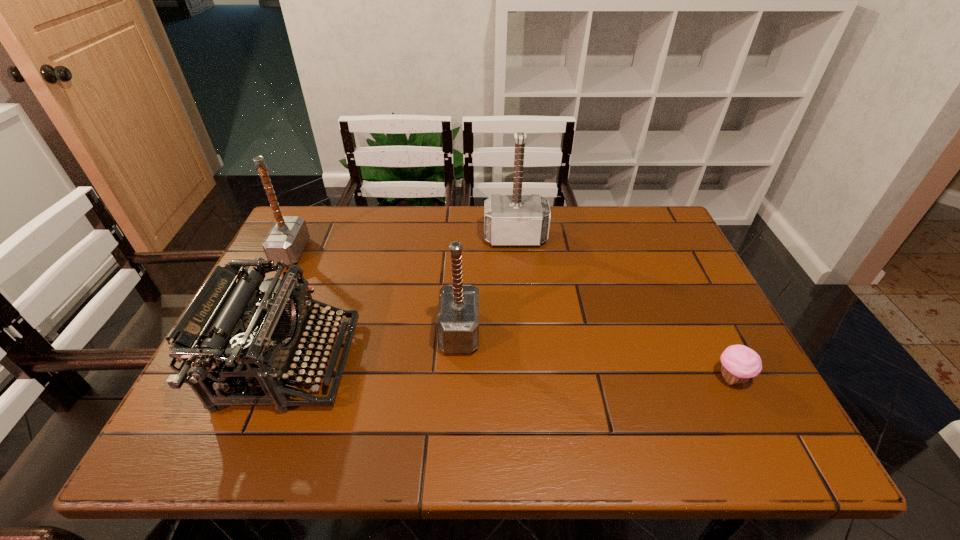
You are a GUI agent. You are given a task and a screenshot of the screen. Output one action in this format:
    pyautogui.click(x=<x>, y=<y>)
    Task: Click on the vacant area located on the typing side of the typewriter
    The height and width of the screenshot is (540, 960).
    Given the screenshot: What is the action you would take?
    pyautogui.click(x=377, y=362)

The image size is (960, 540). In order to click on vacant point located on the back of the cupcake in this screenshot , I will do `click(688, 292)`.

Find the location of `object that is at the near edge`. object that is at the near edge is located at coordinates (236, 337).

Image resolution: width=960 pixels, height=540 pixels. What are the coordinates of `hammer present at the left edge` in the screenshot? It's located at (287, 238).

You are a GUI agent. You are given a task and a screenshot of the screen. Output one action in this format:
    pyautogui.click(x=<x>, y=<y>)
    Task: Click on the typewriter located in the left edge section of the desktop
    This screenshot has width=960, height=540.
    Given the screenshot: What is the action you would take?
    pyautogui.click(x=236, y=337)

The height and width of the screenshot is (540, 960). What are the coordinates of `object at the right edge` in the screenshot? It's located at (739, 363).

Find the location of `object located in the far left corner section of the desktop`. object located in the far left corner section of the desktop is located at coordinates (287, 238).

Where is `object at the near left corner`? object at the near left corner is located at coordinates (236, 337).

The height and width of the screenshot is (540, 960). Identify the location of free region at the far edge of the desktop. (431, 249).

The width and height of the screenshot is (960, 540). In order to click on blank space at the near edge of the desktop in this screenshot , I will do `click(400, 440)`.